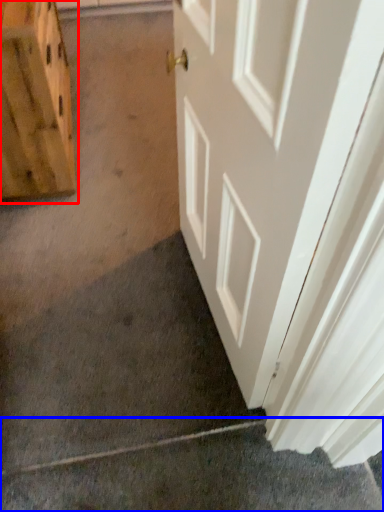
Question: Which of the following is the farthest to the observer, cabinetry (highlighted by a red box) or concrete (highlighted by a blue box)?

Choices:
 (A) cabinetry
 (B) concrete

Answer: (A)